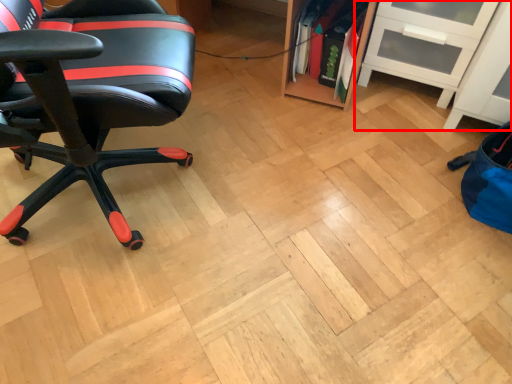
Question: From the image's perspective, considering the relative positions of shelf (annotated by the red box) and chair in the image provided, where is shelf (annotated by the red box) located with respect to the staircase?

Choices:
 (A) below
 (B) above

Answer: (B)